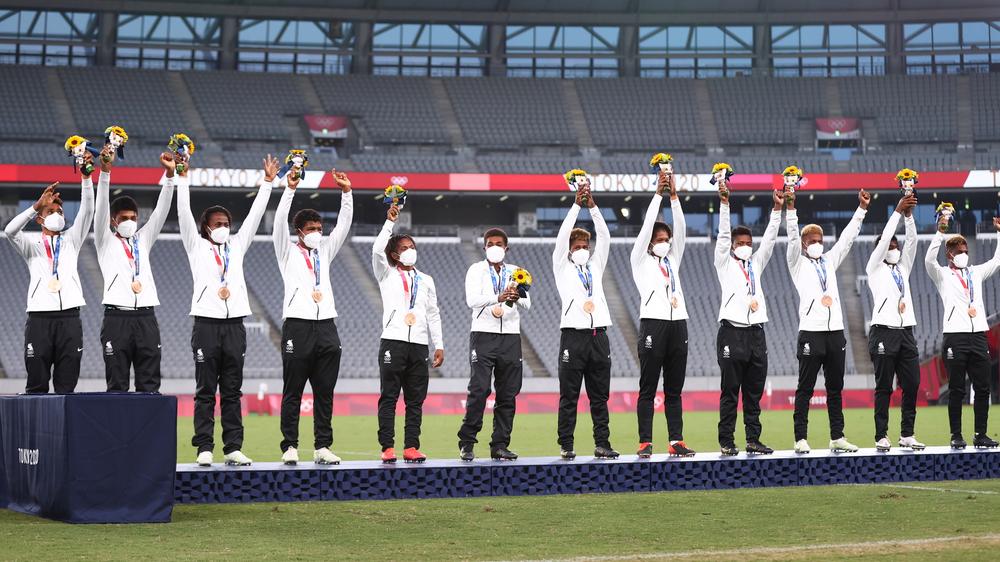
The width and height of the screenshot is (1000, 562). In order to click on smaller podium in this screenshot , I will do `click(59, 423)`.